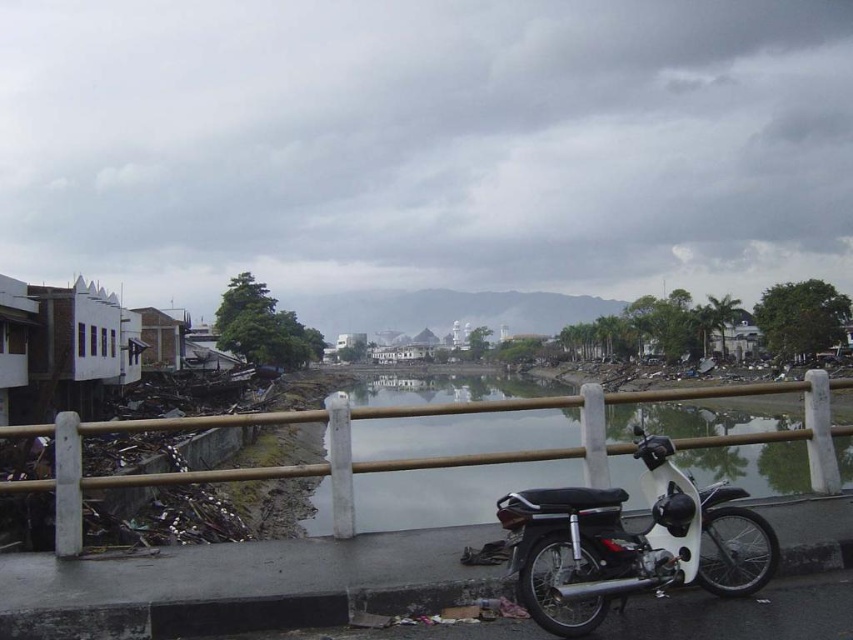
Question: Which of the following is the closest to the observer?

Choices:
 (A) white concrete fence at center
 (B) white matte motorcycle at lower right

Answer: (B)

Question: Which point appears closest to the camera in this image?

Choices:
 (A) (679, 531)
 (B) (822, 413)

Answer: (A)

Question: Does white concrete fence at center have a larger size compared to white matte motorcycle at lower right?

Choices:
 (A) yes
 (B) no

Answer: (A)

Question: Observing the image, what is the correct spatial positioning of white concrete fence at center in reference to white matte motorcycle at lower right?

Choices:
 (A) right
 (B) left

Answer: (B)

Question: Can you confirm if white concrete fence at center is thinner than white matte motorcycle at lower right?

Choices:
 (A) yes
 (B) no

Answer: (B)